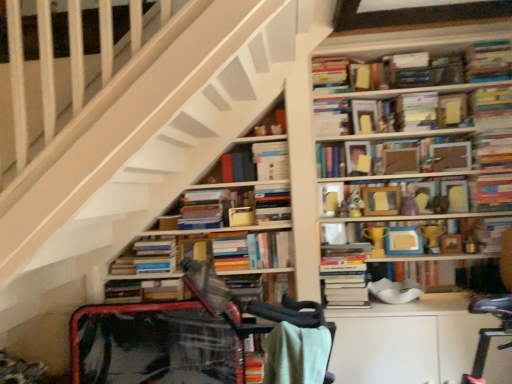
Question: Is hardcover books at upper center, which ranks as the 11th book in bottom-to-top order, looking in the opposite direction of matte cardboard frame at upper center, arranged as the 5th paperback book when viewed from the top?

Choices:
 (A) yes
 (B) no

Answer: (B)

Question: Is hardcover books at upper center, the 6th book positioned from the top, oriented towards matte cardboard frame at upper center, arranged as the 5th paperback book when viewed from the top?

Choices:
 (A) yes
 (B) no

Answer: (B)

Question: From the image's perspective, is hardcover books at upper center, which ranks as the 11th book in bottom-to-top order, located beneath matte cardboard frame at upper center, arranged as the 5th paperback book when viewed from the top?

Choices:
 (A) yes
 (B) no

Answer: (A)

Question: Can you confirm if hardcover books at upper center, which ranks as the 11th book in bottom-to-top order, is wider than matte cardboard frame at upper center, which is the second paperback book in bottom-to-top order?

Choices:
 (A) no
 (B) yes

Answer: (B)

Question: Does hardcover books at upper center, the 6th book positioned from the top, lie behind matte cardboard frame at upper center, which is the second paperback book in bottom-to-top order?

Choices:
 (A) no
 (B) yes

Answer: (A)

Question: Does hardcover books at upper center, which ranks as the 11th book in bottom-to-top order, have a smaller size compared to matte cardboard frame at upper center, which is the second paperback book in bottom-to-top order?

Choices:
 (A) no
 (B) yes

Answer: (A)

Question: Considering the relative positions of matte paper book at upper right, marked as the 1th paperback book in a top-to-bottom arrangement, and hardcover book at upper right, arranged as the first book when viewed from the top, in the image provided, is matte paper book at upper right, marked as the 1th paperback book in a top-to-bottom arrangement, behind hardcover book at upper right, arranged as the first book when viewed from the top,?

Choices:
 (A) yes
 (B) no

Answer: (A)

Question: Is matte paper book at upper right, marked as the 1th paperback book in a top-to-bottom arrangement, outside of hardcover book at upper right, the 16th book positioned from the bottom?

Choices:
 (A) no
 (B) yes

Answer: (B)

Question: Is matte paper book at upper right, the sixth paperback book positioned from the bottom, aimed at hardcover book at upper right, arranged as the first book when viewed from the top?

Choices:
 (A) yes
 (B) no

Answer: (B)

Question: Can you confirm if matte paper book at upper right, the sixth paperback book positioned from the bottom, is positioned to the right of hardcover book at upper right, arranged as the first book when viewed from the top?

Choices:
 (A) no
 (B) yes

Answer: (A)

Question: Is matte paper book at upper right, marked as the 1th paperback book in a top-to-bottom arrangement, not near hardcover book at upper right, the 16th book positioned from the bottom?

Choices:
 (A) no
 (B) yes

Answer: (A)

Question: Is the position of matte paper book at upper right, the sixth paperback book positioned from the bottom, less distant than that of hardcover book at upper right, arranged as the first book when viewed from the top?

Choices:
 (A) yes
 (B) no

Answer: (B)

Question: Does matte yellow trophy at center, the eleventh book positioned from the top, appear on the right side of matte cardboard frame at upper center, arranged as the 5th paperback book when viewed from the top?

Choices:
 (A) no
 (B) yes

Answer: (B)